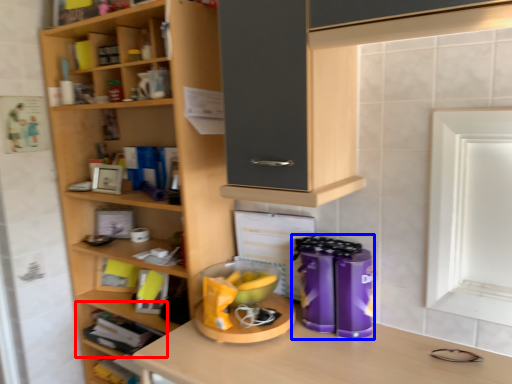
Question: Which of the following is the closest to the observer, shelf (highlighted by a red box) or appliance (highlighted by a blue box)?

Choices:
 (A) shelf
 (B) appliance

Answer: (B)